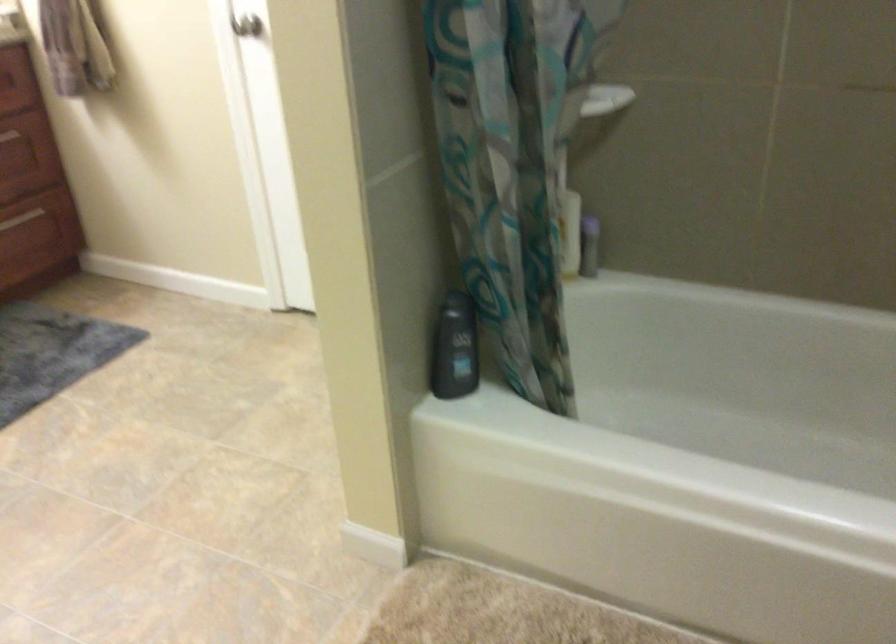
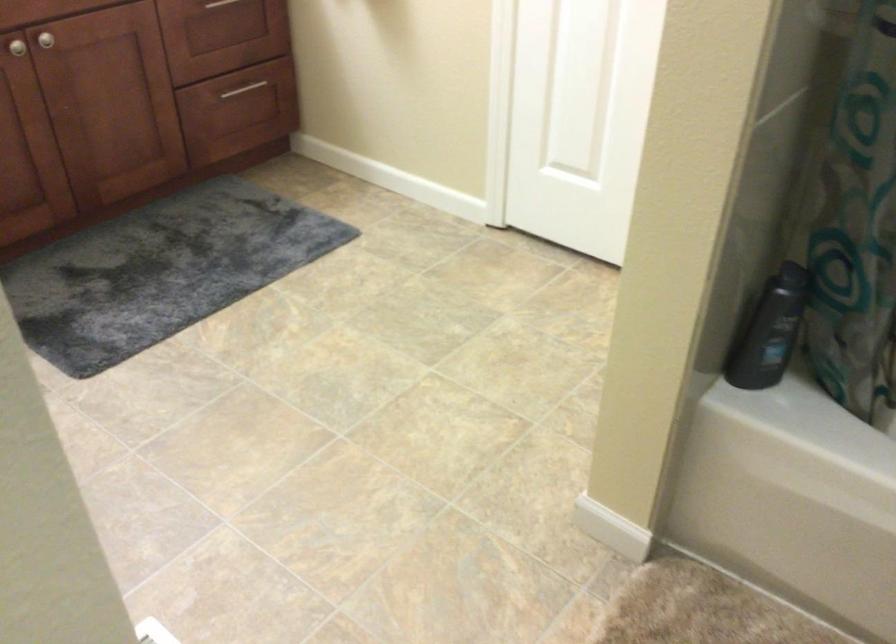
Question: The first image is from the beginning of the video and the second image is from the end. How did the camera likely rotate when shooting the video?

Choices:
 (A) Left
 (B) Right
 (C) Up
 (D) Down

Answer: (A)